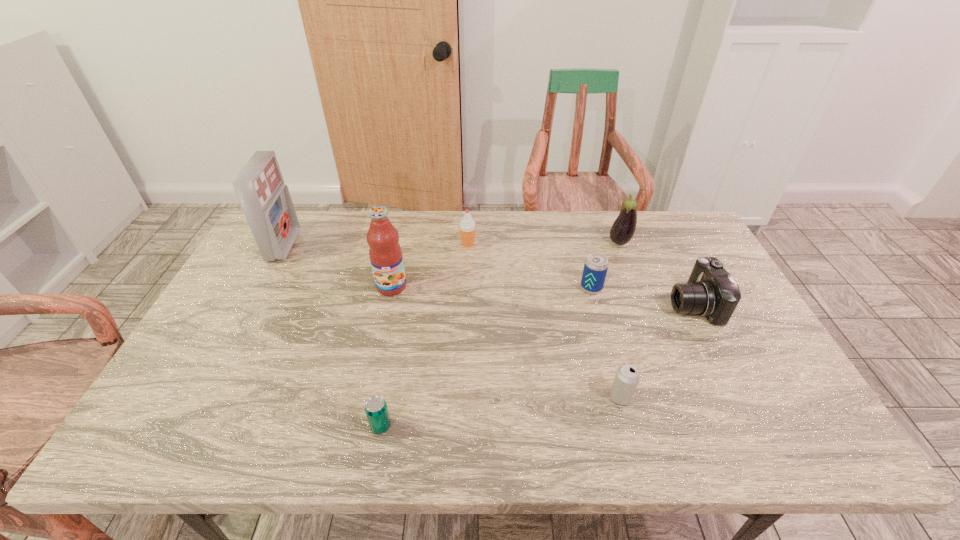
Image resolution: width=960 pixels, height=540 pixels. Find the location of `the leftmost object`. the leftmost object is located at coordinates (266, 202).

This screenshot has width=960, height=540. In order to click on fruit juice in this screenshot , I will do `click(385, 253)`.

Identify the location of the second object from right to left. (622, 231).

This screenshot has width=960, height=540. In order to click on the third tallest object in this screenshot , I will do `click(622, 231)`.

I want to click on the fourth object from left to right, so click(467, 228).

The image size is (960, 540). Find the location of `the rightmost object`. the rightmost object is located at coordinates (711, 291).

Identify the location of the farthest beer can. (596, 265).

Where is `the seventh farthest object`? the seventh farthest object is located at coordinates (627, 377).

Where is `the leftmost beer can`? Image resolution: width=960 pixels, height=540 pixels. the leftmost beer can is located at coordinates pyautogui.click(x=376, y=409).

Where is `the nearest object`? The height and width of the screenshot is (540, 960). the nearest object is located at coordinates (376, 409).